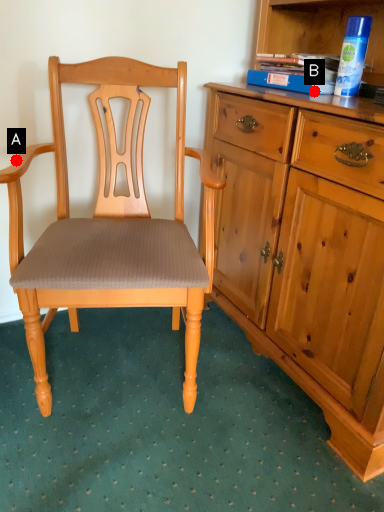
Question: Two points are circled on the image, labeled by A and B beside each circle. Which of the following is the closest to the observer?

Choices:
 (A) A is closer
 (B) B is closer

Answer: (A)